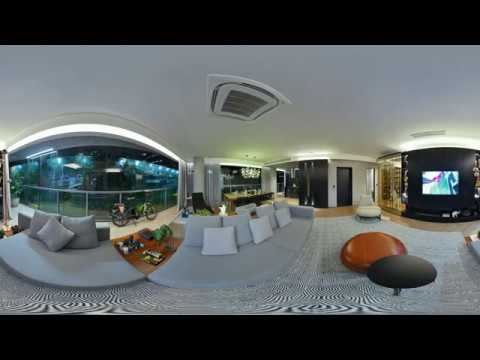
You are a GUI agent. You are given a task and a screenshot of the screen. Output one action in this format:
    pyautogui.click(x=<x>, y=<y>)
    Task: Click on the stool
    
    Given the screenshot: What is the action you would take?
    pyautogui.click(x=397, y=275)